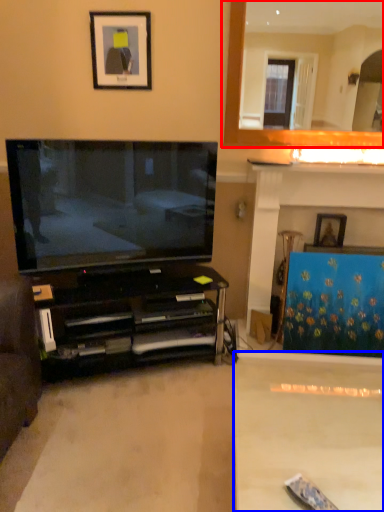
Question: Which of the following is the closest to the observer, fireplace (highlighted by a red box) or plain (highlighted by a blue box)?

Choices:
 (A) fireplace
 (B) plain

Answer: (B)